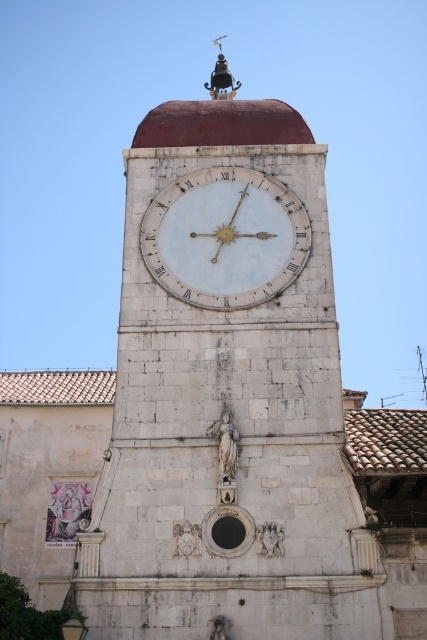
Question: Which object appears closest to the camera in this image?

Choices:
 (A) white marble clock at center
 (B) white stone clock at center

Answer: (B)

Question: Among these points, which one is nearest to the camera?

Choices:
 (A) (322, 612)
 (B) (160, 268)
 (C) (216, 68)

Answer: (A)

Question: Which of these objects is positioned farthest from the white stone clock at center?

Choices:
 (A) white marble clock at center
 (B) polished brass bell at upper center

Answer: (B)

Question: Does white marble clock at center have a lesser width compared to polished brass bell at upper center?

Choices:
 (A) yes
 (B) no

Answer: (B)

Question: Does white marble clock at center lie in front of polished brass bell at upper center?

Choices:
 (A) no
 (B) yes

Answer: (B)

Question: Is white stone clock at center to the left of polished brass bell at upper center from the viewer's perspective?

Choices:
 (A) no
 (B) yes

Answer: (B)